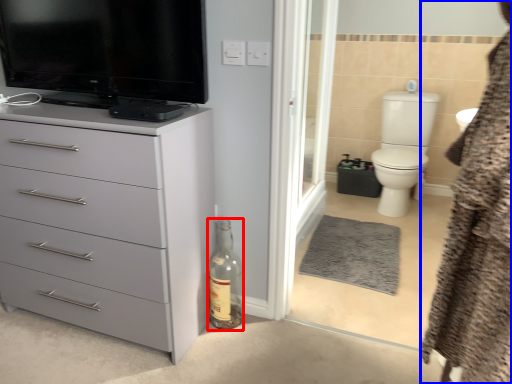
Question: Among these objects, which one is nearest to the camera, bottle (highlighted by a red box) or bathrobe (highlighted by a blue box)?

Choices:
 (A) bottle
 (B) bathrobe

Answer: (B)